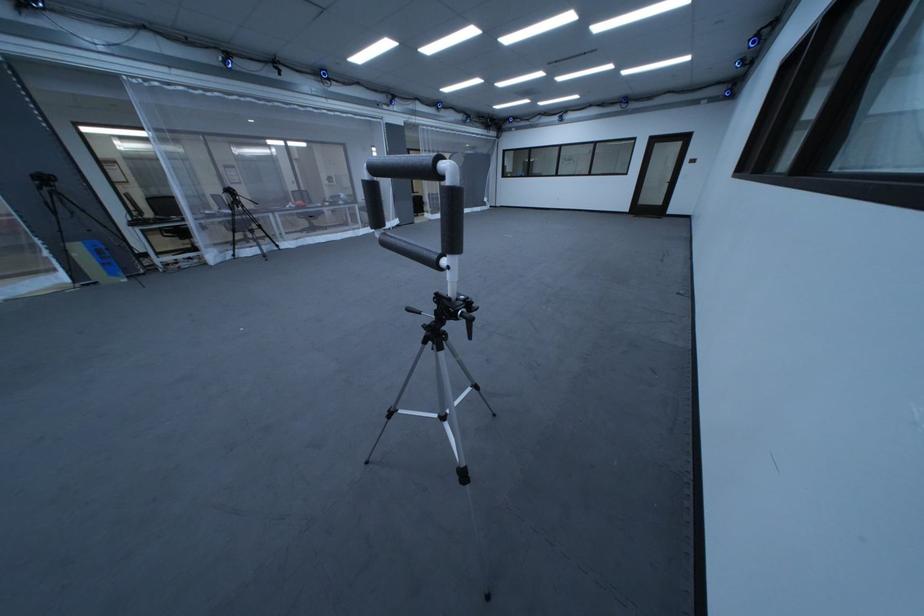
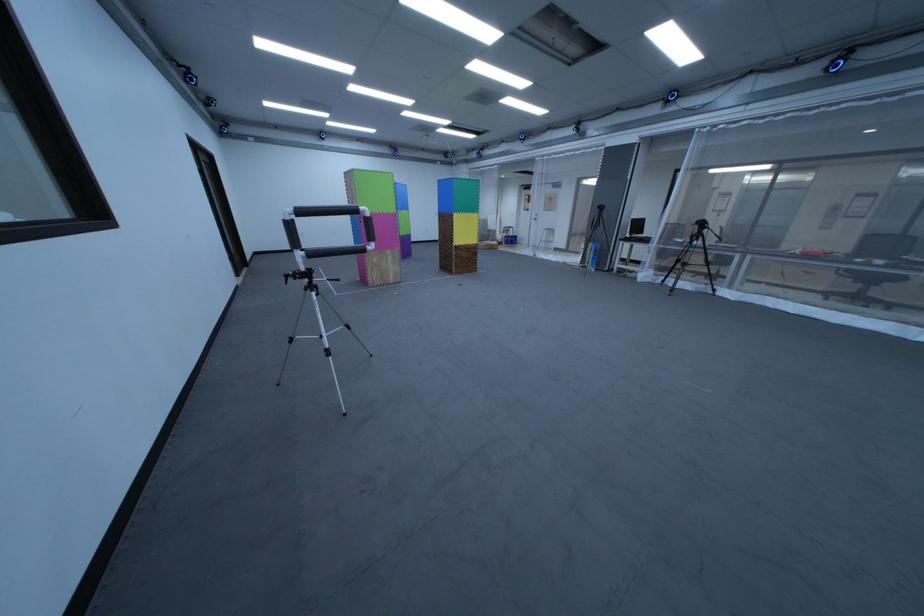
Locate, in the second image, the point that corresponds to point 343,205 in the first image.

(895, 262)